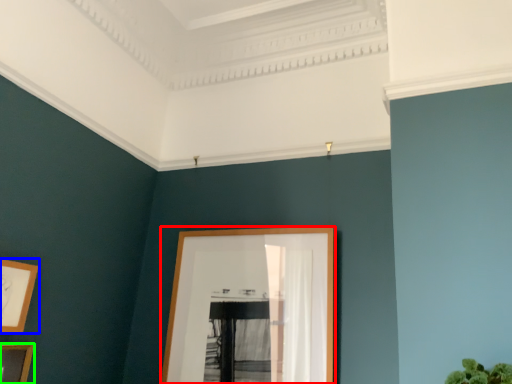
Question: Which object is the farthest from picture frame (highlighted by a red box)? Choose among these: picture frame (highlighted by a blue box) or picture frame (highlighted by a green box).

Choices:
 (A) picture frame
 (B) picture frame

Answer: (B)